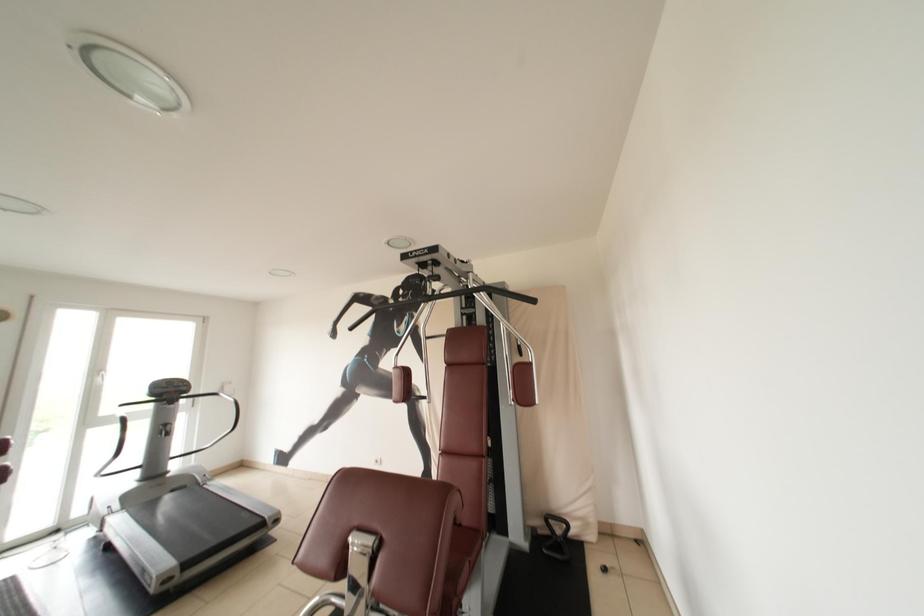
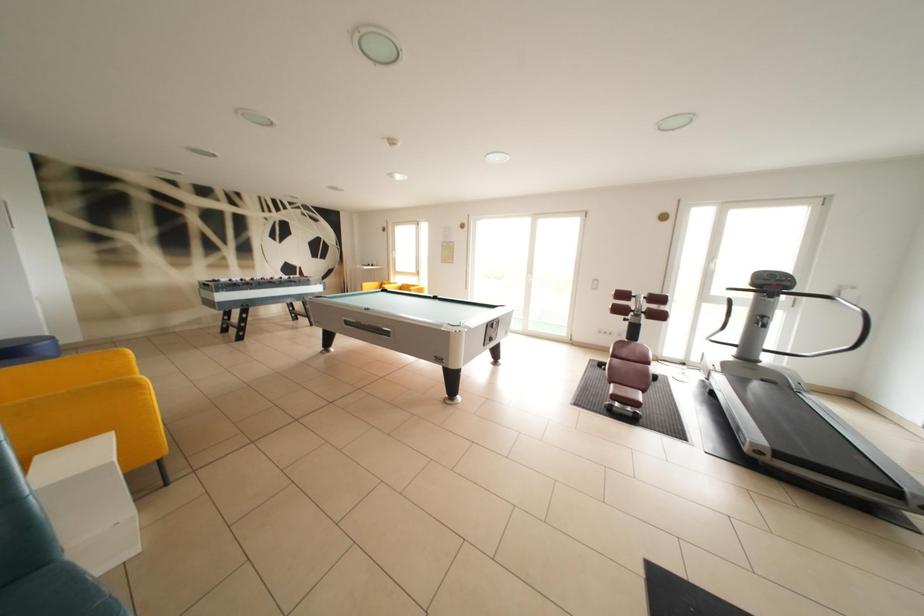
Question: The images are taken continuously from a first-person perspective. In which direction is your viewpoint rotating?

Choices:
 (A) Left
 (B) Right
 (C) Up
 (D) Down

Answer: (A)